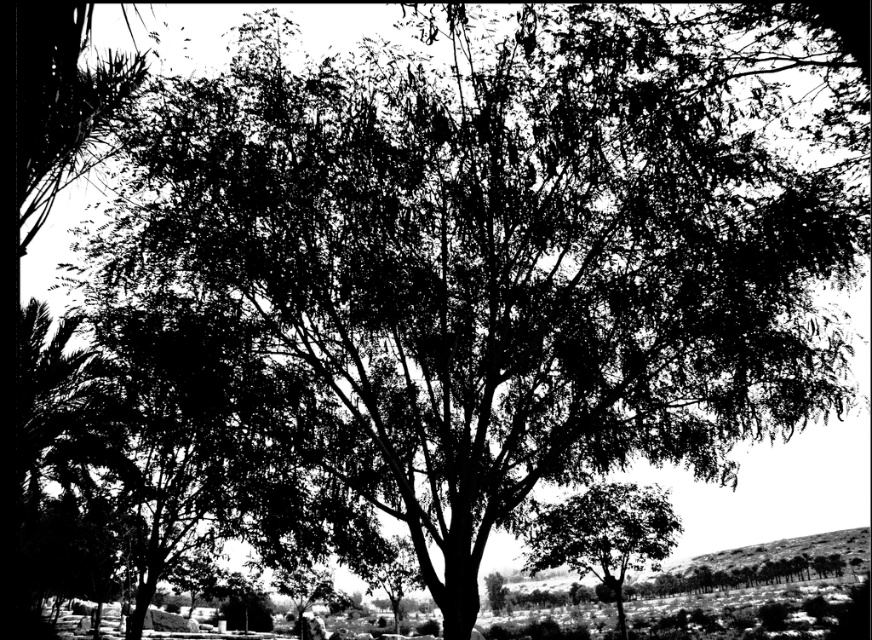
Is smooth green tree at lower right in front of smooth dirt hillside at lower right?

That is False.

The image size is (872, 640). What do you see at coordinates (603, 534) in the screenshot?
I see `smooth green tree at lower right` at bounding box center [603, 534].

This screenshot has width=872, height=640. What are the coordinates of `smooth green tree at lower right` in the screenshot? It's located at (603, 534).